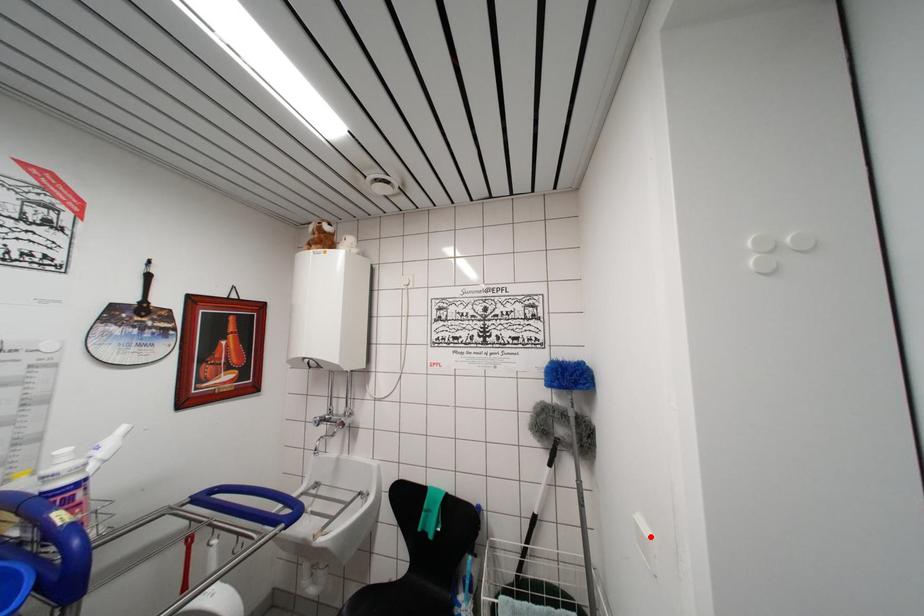
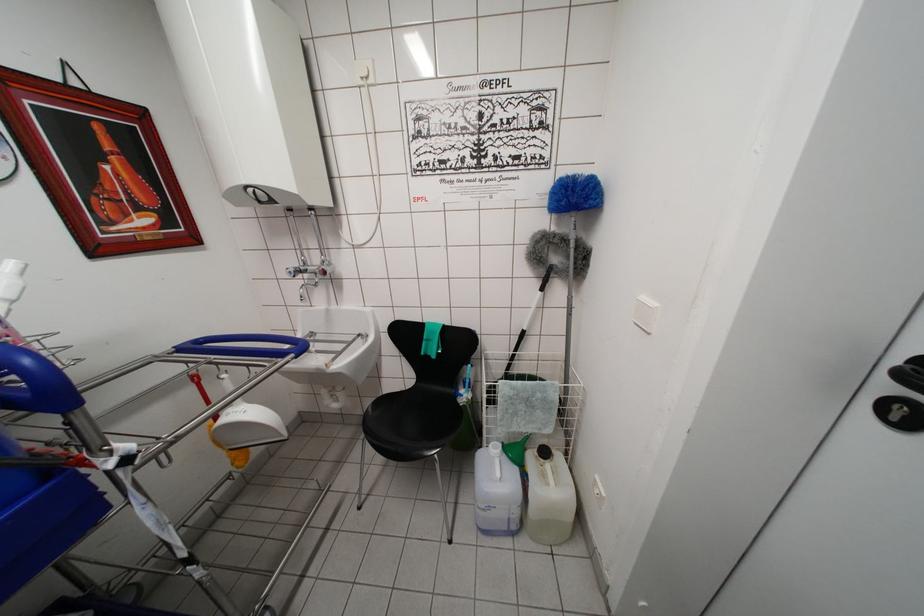
Where in the second image is the point corresponding to the highlighted location from the first image?

(657, 308)